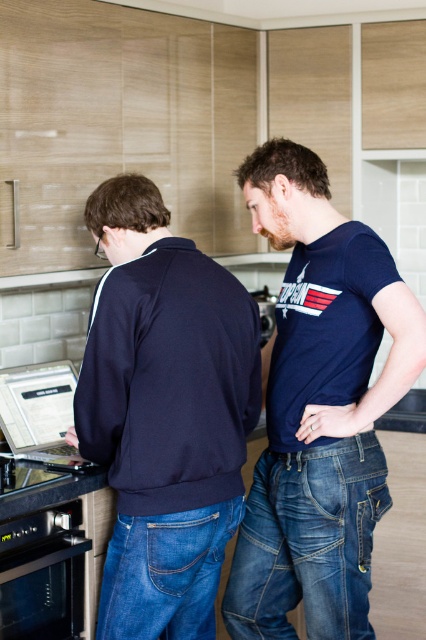
You are standing in the kitchen and need to place a new appliance next to the silver metallic laptop at left. Which direction should you move to locate the black stainless steel oven at lower left for reference?

The black stainless steel oven at lower left is to the right of the silver metallic laptop at left, so you should move to the right of the silver metallic laptop at left to locate it.

You are standing in the kitchen and need to access the silver metallic laptop at left. However, the black stainless steel oven at lower left is blocking your path. Can you move the oven to reach the laptop?

The black stainless steel oven at lower left is in front of the silver metallic laptop at left, so you cannot move the oven to reach the laptop because ovens are typically heavy and immovable appliances.

You are standing in the kitchen and want to reach the metallic silver toaster at center without moving the silver metallic laptop at left. Is this possible?

The silver metallic laptop at left is to the left of the metallic silver toaster at center, so you can reach the metallic silver toaster at center by moving around to its right side without disturbing the laptop.